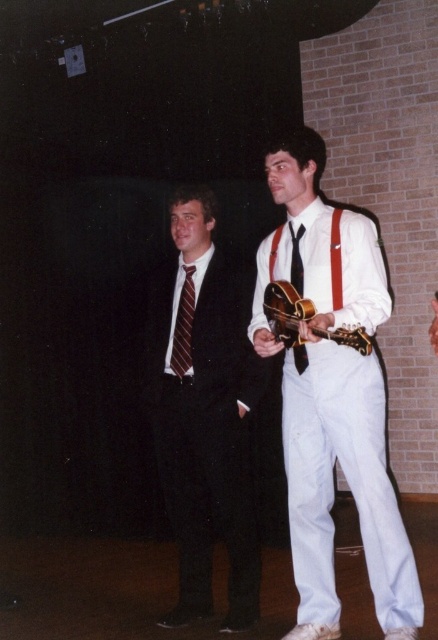
You are an actor standing on stage and need to place a small prop at the point marked as point [334,397]. Based on the scene description, where exactly on the white matte shirt at center should you place the prop?

The point [334,397] is located on the white matte shirt at center, so you should place the prop on the white matte shirt at center.

You are a costume designer preparing for a play and need to ensure the actors have the correct accessories. Given the striped fabric tie at center and the black leather belt at center, which accessory is bigger in size?

The striped fabric tie at center is larger in size than the black leather belt at center.